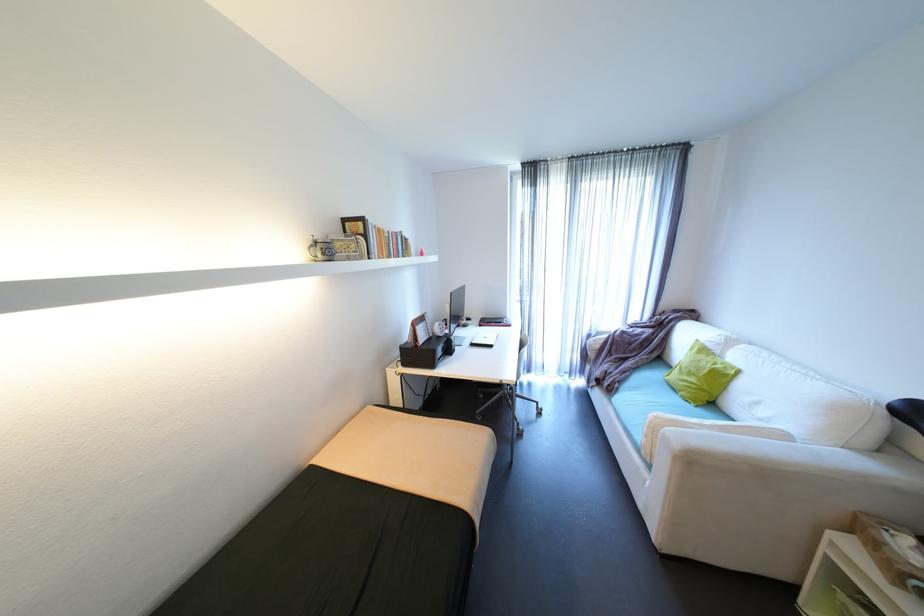
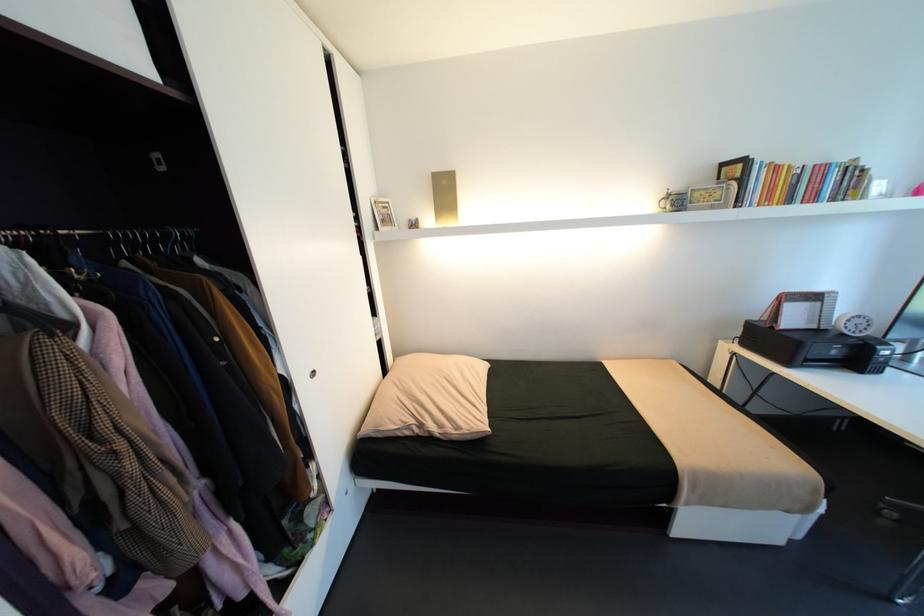
Where in the second image is the point corresponding to point (342, 246) from the first image?

(700, 196)